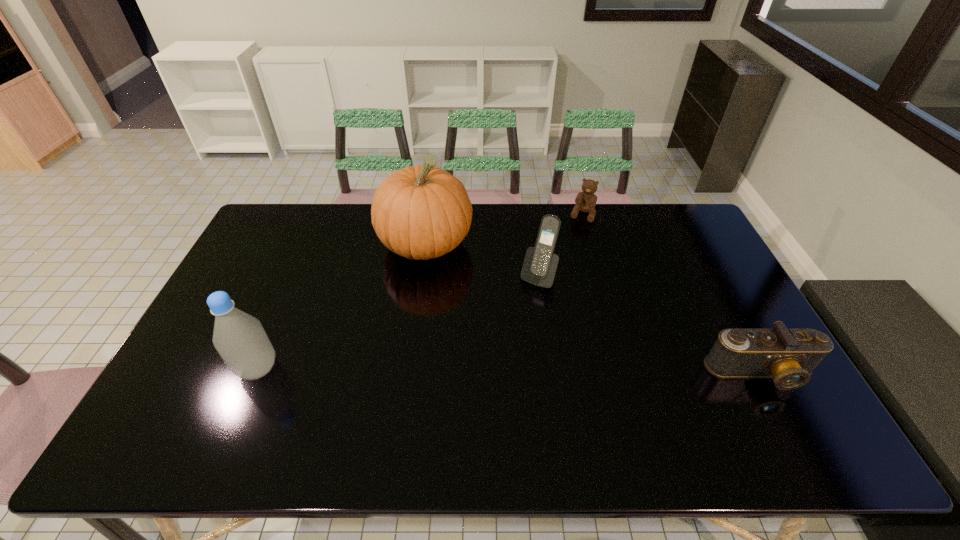
Find the location of a particular element. The height and width of the screenshot is (540, 960). vacant space at the far left corner of the desktop is located at coordinates (278, 228).

At what (x,y) coordinates should I click in order to perform the action: click on free space between the teddy bear and the bottle. Please return your answer as a coordinate pair (x, y). The image size is (960, 540). Looking at the image, I should click on (420, 292).

This screenshot has width=960, height=540. I want to click on free space that is in between the second object from right to left and the tallest object, so click(504, 230).

At what (x,y) coordinates should I click in order to perform the action: click on vacant area between the pumpkin and the rightmost object. Please return your answer as a coordinate pair (x, y). This screenshot has width=960, height=540. Looking at the image, I should click on (593, 309).

Locate an element on the screen. free space between the third shortest object and the teddy bear is located at coordinates (561, 246).

Locate an element on the screen. vacant area that lies between the leftmost object and the teddy bear is located at coordinates (420, 292).

The width and height of the screenshot is (960, 540). Identify the location of vacant point located between the second object from left to right and the cellular telephone. (482, 260).

Locate an element on the screen. The width and height of the screenshot is (960, 540). free space between the bottle and the rightmost object is located at coordinates (509, 371).

Locate an element on the screen. The image size is (960, 540). unoccupied position between the cellular telephone and the leftmost object is located at coordinates (397, 322).

I want to click on blank region between the second object from right to left and the third object from right to left, so click(x=561, y=246).